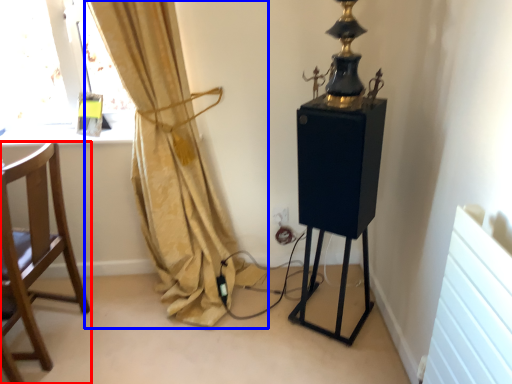
Question: Which object appears closest to the camera in this image, chair (highlighted by a red box) or curtain (highlighted by a blue box)?

Choices:
 (A) chair
 (B) curtain

Answer: (B)